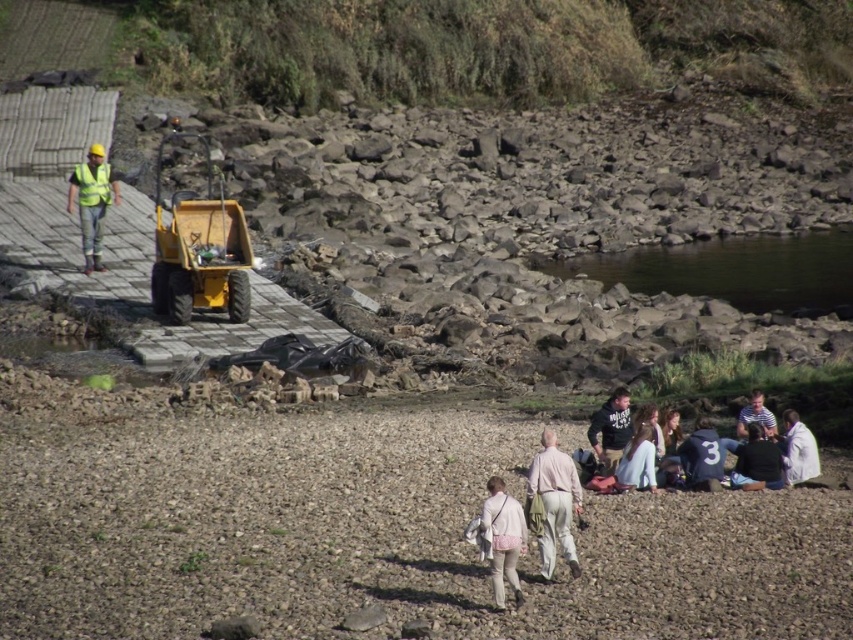
Question: From the image, what is the correct spatial relationship of light beige cotton pants at center in relation to yellow reflective vest at left?

Choices:
 (A) below
 (B) above

Answer: (A)

Question: Which point is farther to the camera?

Choices:
 (A) light beige cotton pants at center
 (B) reflective yellow safety vest at left
 (C) yellow reflective vest at left
 (D) light beige pants at center

Answer: (B)

Question: Is yellow rubber excavator at center behind dark gray hoodie at lower right?

Choices:
 (A) no
 (B) yes

Answer: (B)

Question: Can you confirm if yellow rubber excavator at center is positioned to the left of reflective yellow safety vest at left?

Choices:
 (A) yes
 (B) no

Answer: (B)

Question: Which point is farther from the camera taking this photo?

Choices:
 (A) (103, 166)
 (B) (618, 410)
 (C) (514, 556)

Answer: (A)

Question: Which point appears farthest from the camera in this image?

Choices:
 (A) (80, 182)
 (B) (602, 429)
 (C) (570, 472)

Answer: (A)